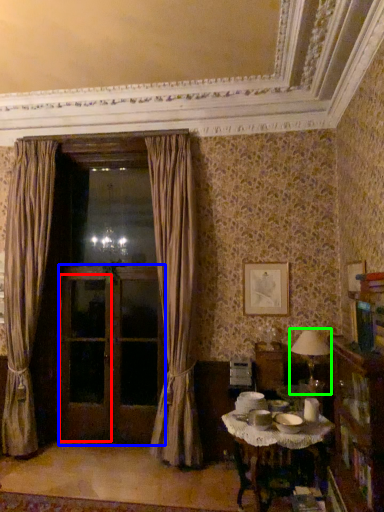
Question: Which is nearer to the screen door (highlighted by a red box)? screen door (highlighted by a blue box) or table lamp (highlighted by a green box).

Choices:
 (A) screen door
 (B) table lamp

Answer: (A)